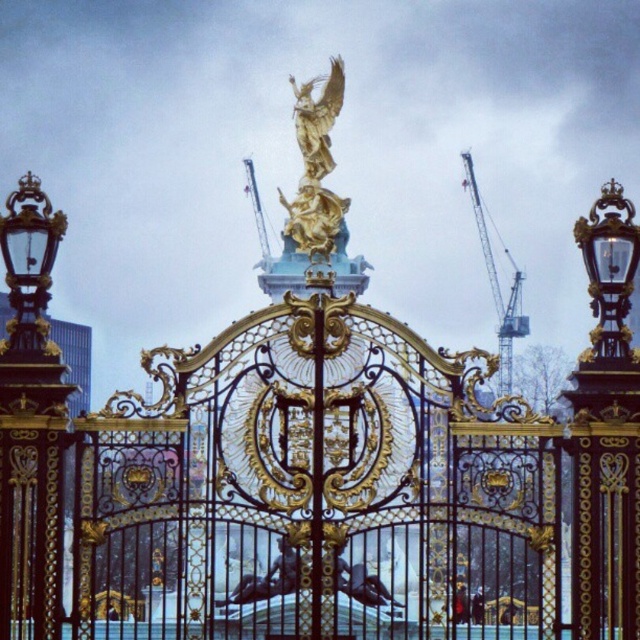
Does gold ornate gate at center lie in front of metallic gray crane at upper right?

That is True.

Who is more forward, (x=452, y=404) or (x=472, y=205)?

Point (x=452, y=404) is in front.

Is point (552, 525) positioned after point (486, 259)?

No, (552, 525) is in front of (486, 259).

Locate an element on the screen. This screenshot has height=640, width=640. gold ornate gate at center is located at coordinates (317, 492).

Is gold ornate lamp post at left further to camera compared to polished brass lantern at upper right?

That is False.

Can you confirm if gold ornate lamp post at left is positioned to the right of polished brass lantern at upper right?

Incorrect, gold ornate lamp post at left is not on the right side of polished brass lantern at upper right.

The width and height of the screenshot is (640, 640). What do you see at coordinates (29, 269) in the screenshot?
I see `gold ornate lamp post at left` at bounding box center [29, 269].

The height and width of the screenshot is (640, 640). Identify the location of gold ornate lamp post at left. (29, 269).

Which is behind, point (214, 593) or point (598, 243)?

The point (598, 243) is behind.

Can you confirm if gold ornate gate at center is wider than polished brass lantern at upper right?

Indeed, gold ornate gate at center has a greater width compared to polished brass lantern at upper right.

Locate an element on the screen. The image size is (640, 640). gold ornate gate at center is located at coordinates (317, 492).